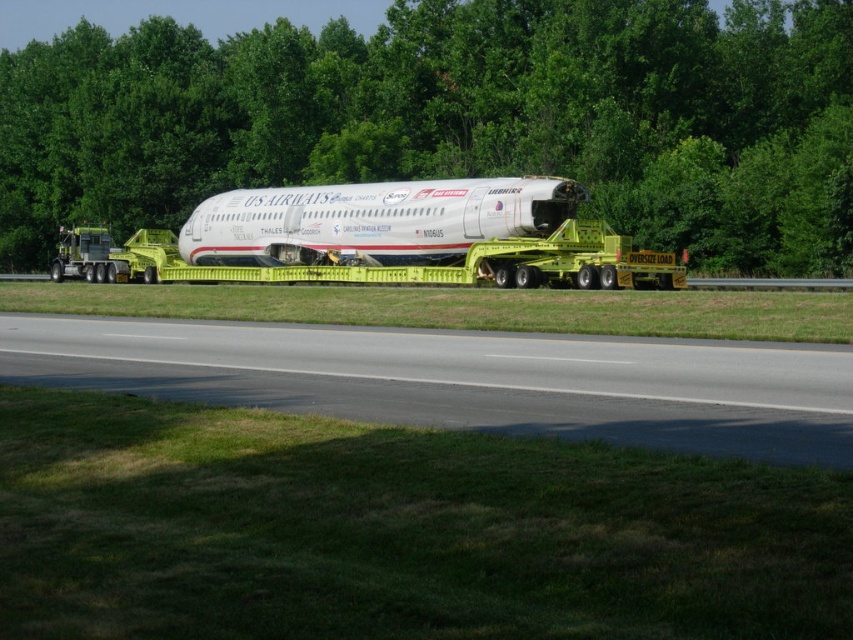
You are a pilot preparing to land a small Cessna airplane. You see the gray asphalt runway at lower center and the white matte airplane at center in your view. Which direction should you adjust your approach to align with the runway?

You should adjust your approach to the left because the gray asphalt runway at lower center is to the right of the white matte airplane at center, meaning the runway is positioned to the right of the airplane, so steering left would align you with the runway.

You are a driver of a 15 meter long truck that needs to pass through a narrow alley between the green leafy tree at center and the yellow metallic tow truck at center. Can your truck fit through the space between them?

The distance between the green leafy tree at center and the yellow metallic tow truck at center is 22.97 meters. Since your truck is 15 meters long, it can fit through the space as there is enough clearance.

From the picture: You are standing at a safe distance observing a large US Airways aircraft being transported on a yellow flatbed trailer. The airplane has a registration number N060US. You want to take a photo of the white matte airplane at center from your current position. Considering the distance, will the airplane appear large or small in your photo?

The white matte airplane at center is 40.86 meters away from the viewer. Since this distance is quite far, the airplane will appear small in the photo.